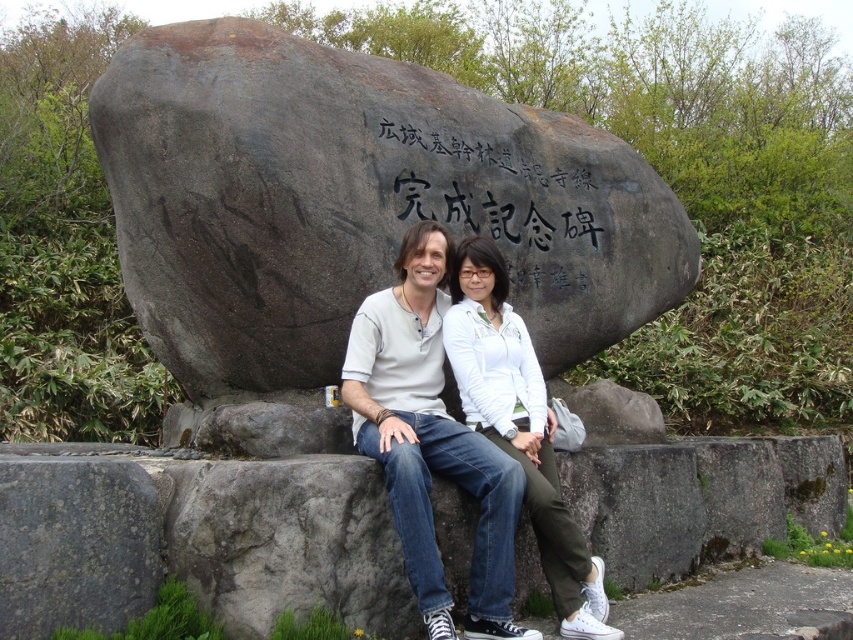
Does gray rough stone at lower left have a greater width compared to black stone engraving at center?

No.

Does gray rough stone at lower left appear on the right side of black stone engraving at center?

No, gray rough stone at lower left is not to the right of black stone engraving at center.

Measure the distance between point [50,512] and camera.

4.67 meters

The width and height of the screenshot is (853, 640). I want to click on gray rough stone at lower left, so click(74, 544).

Is point (436, 332) less distant than point (90, 545)?

No, (436, 332) is further to viewer.

Where is `matte white shirt at center`? matte white shirt at center is located at coordinates (430, 438).

Does dark gray stone boulder at center lie behind matte white shirt at center?

That is True.

Is point (572, 140) closer to viewer compared to point (550, 582)?

No.

Between point (143, 134) and point (426, 506), which one is positioned behind?

The point (143, 134) is behind.

Where is `dark gray stone boulder at center`? This screenshot has height=640, width=853. dark gray stone boulder at center is located at coordinates (355, 202).